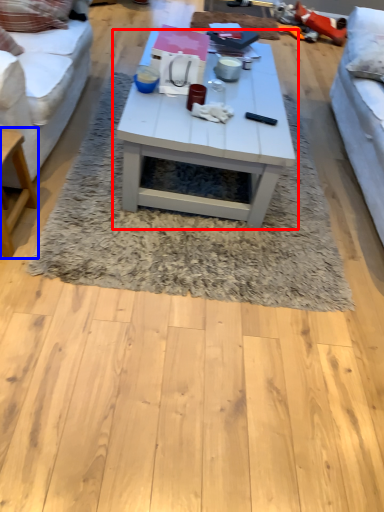
Question: Which object is further to the camera taking this photo, coffee table (highlighted by a red box) or table (highlighted by a blue box)?

Choices:
 (A) coffee table
 (B) table

Answer: (A)